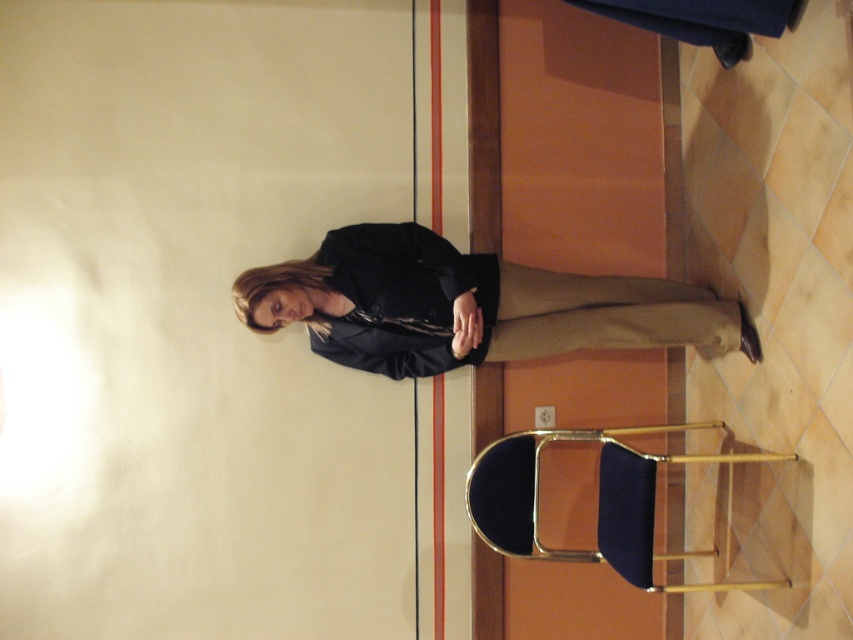
Can you confirm if matte black blazer at center is shorter than velvet blue chair at lower right?

Indeed, matte black blazer at center has a lesser height compared to velvet blue chair at lower right.

Where is `matte black blazer at center`? The height and width of the screenshot is (640, 853). matte black blazer at center is located at coordinates (486, 305).